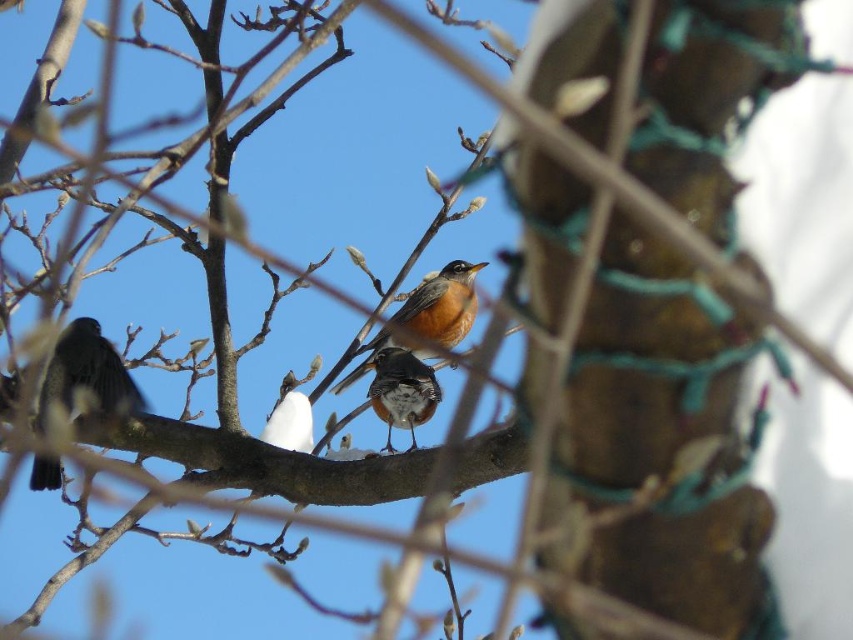
Who is more distant from viewer, (77, 326) or (364, 372)?

Positioned behind is point (364, 372).

Which is behind, point (134, 387) or point (408, 342)?

Positioned behind is point (408, 342).

Locate an element on the screen. This screenshot has width=853, height=640. matte black bird at left is located at coordinates (86, 372).

Does point (451, 289) come in front of point (302, 422)?

No, it is behind (302, 422).

Find the location of a particular element. The image size is (853, 640). bright orange bird at center is located at coordinates (427, 316).

Is brown speckled feathers at center closer to camera compared to white fluffy bird at center?

That is True.

What do you see at coordinates (402, 392) in the screenshot? I see `brown speckled feathers at center` at bounding box center [402, 392].

Find the location of a particular element. brown speckled feathers at center is located at coordinates (402, 392).